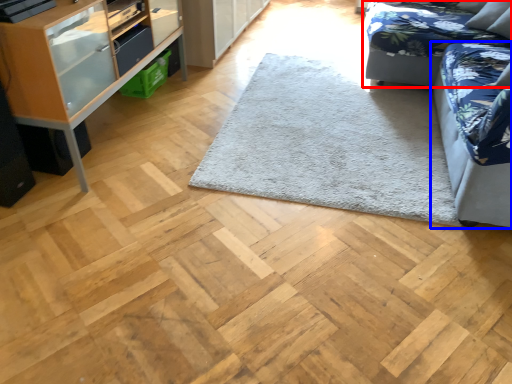
Question: Which object appears farthest to the camera in this image, studio couch (highlighted by a red box) or studio couch (highlighted by a blue box)?

Choices:
 (A) studio couch
 (B) studio couch

Answer: (A)